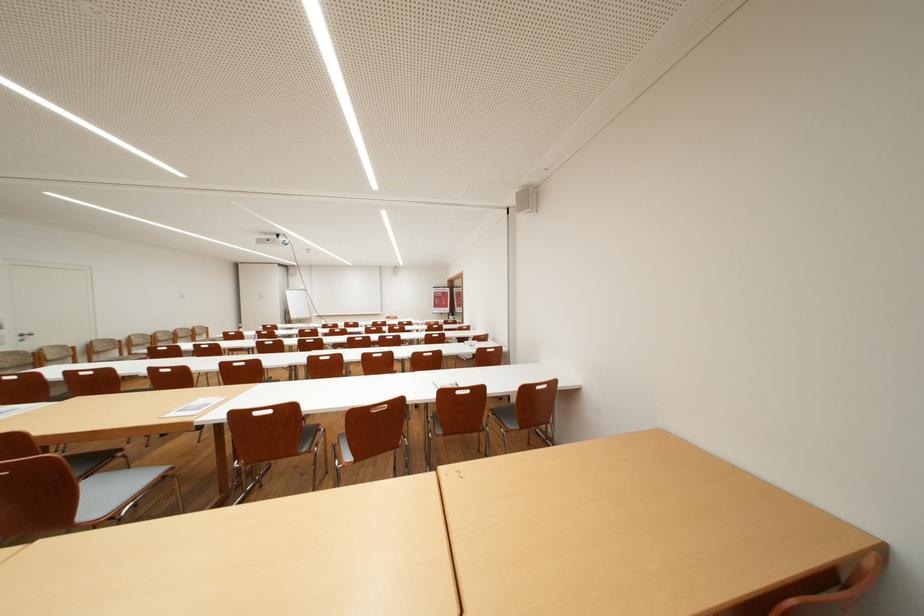
Locate an element on the screen. The height and width of the screenshot is (616, 924). silver door handle is located at coordinates (23, 334).